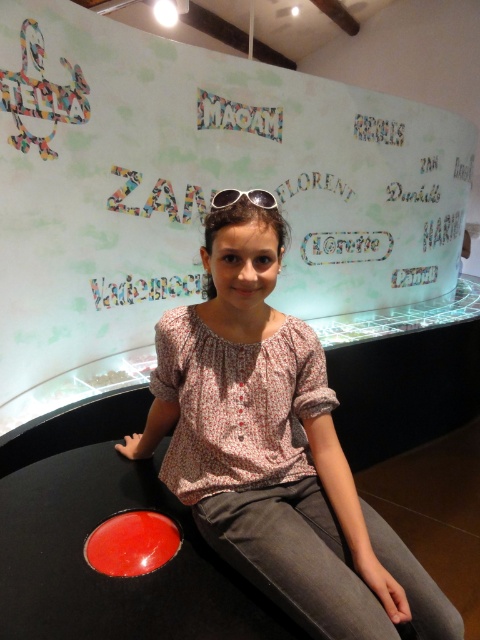
Question: Is pink floral blouse at center bigger than silver reflective sunglasses at center?

Choices:
 (A) yes
 (B) no

Answer: (A)

Question: Which object appears closest to the camera in this image?

Choices:
 (A) pink floral blouse at center
 (B) metallic glass display case at center
 (C) silver reflective sunglasses at center

Answer: (A)

Question: Which point is closer to the camera?

Choices:
 (A) silver reflective sunglasses at center
 (B) metallic glass display case at center

Answer: (A)

Question: Among these objects, which one is nearest to the camera?

Choices:
 (A) pink floral blouse at center
 (B) silver reflective sunglasses at center

Answer: (A)

Question: Does metallic glass display case at center come in front of silver reflective sunglasses at center?

Choices:
 (A) yes
 (B) no

Answer: (B)

Question: Observing the image, what is the correct spatial positioning of pink floral blouse at center in reference to silver reflective sunglasses at center?

Choices:
 (A) below
 (B) above

Answer: (A)